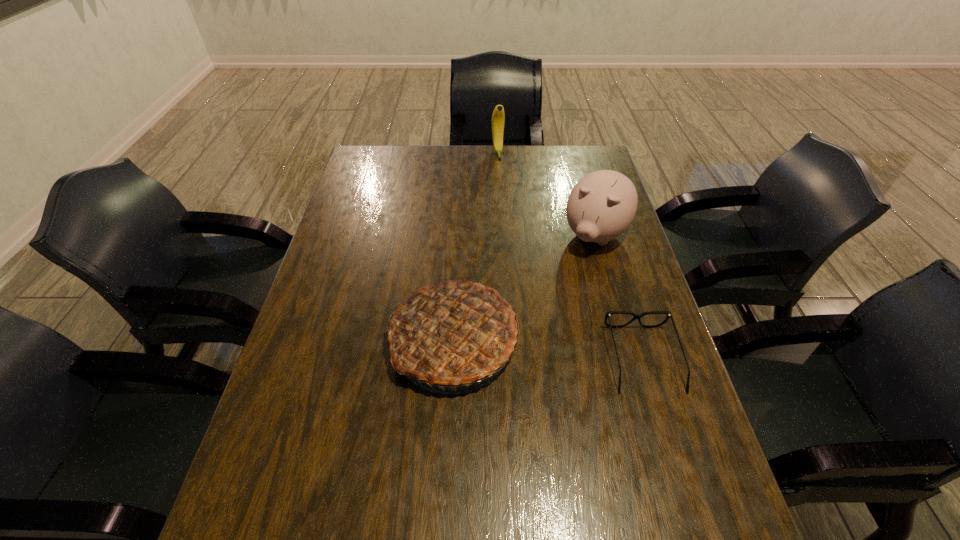
You are a GUI agent. You are given a task and a screenshot of the screen. Output one action in this format:
    pyautogui.click(x=<x>, y=<y>)
    Task: Click on the vacant spot on the desktop that is between the pie and the shortest object and is positioned from the stem of the banana
    
    Given the screenshot: What is the action you would take?
    pyautogui.click(x=537, y=348)

You are a GUI agent. You are given a task and a screenshot of the screen. Output one action in this format:
    pyautogui.click(x=<x>, y=<y>)
    Task: Click on the vacant spot on the desktop that is between the pie and the shortest object and is positioned at the snout of the piggy bank
    
    Given the screenshot: What is the action you would take?
    pyautogui.click(x=526, y=347)